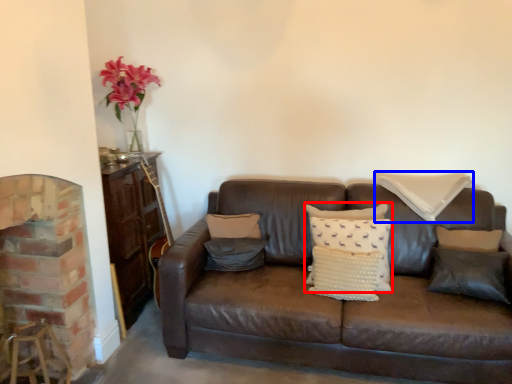
Question: Which object appears closest to the camera in this image, pillow (highlighted by a red box) or pillow (highlighted by a blue box)?

Choices:
 (A) pillow
 (B) pillow

Answer: (A)